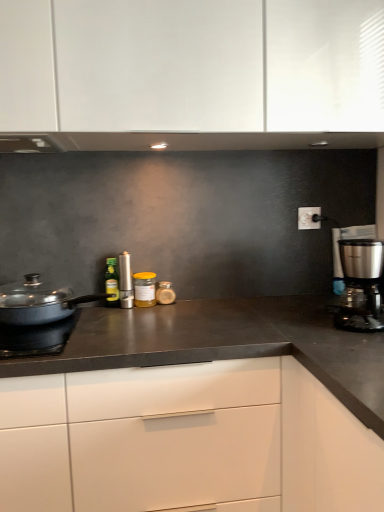
You are a GUI agent. You are given a task and a screenshot of the screen. Output one action in this format:
    pyautogui.click(x=<x>, y=<y>)
    Task: Click on the free space that is to the left of yellow glass jar at center, which is the 3th kitchen appliance in front-to-back order
    The image size is (384, 512).
    Given the screenshot: What is the action you would take?
    pyautogui.click(x=96, y=310)